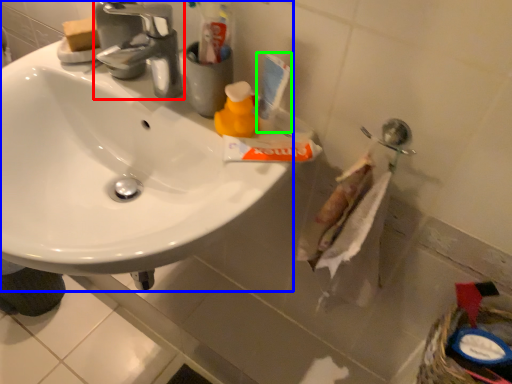
Question: Which object is positioned farthest from tap (highlighted by a red box)? Select from sink (highlighted by a blue box) and toiletry (highlighted by a green box).

Choices:
 (A) sink
 (B) toiletry

Answer: (B)